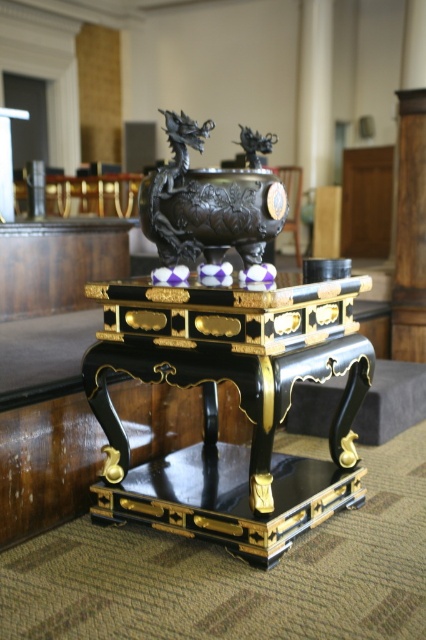
The image size is (426, 640). Identify the location of black lacquer table at center. (239, 404).

Looking at this image, between black lacquer table at center and black polished metal dragon at center, which one is positioned higher?

Positioned higher is black polished metal dragon at center.

Identify the location of black lacquer table at center. The image size is (426, 640). (239, 404).